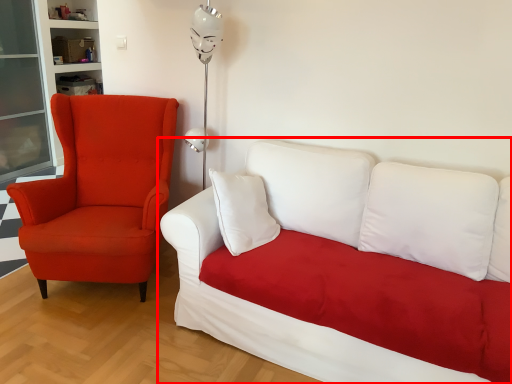
Question: Where is studio couch (annotated by the red box) located in relation to chair in the image?

Choices:
 (A) left
 (B) right

Answer: (B)